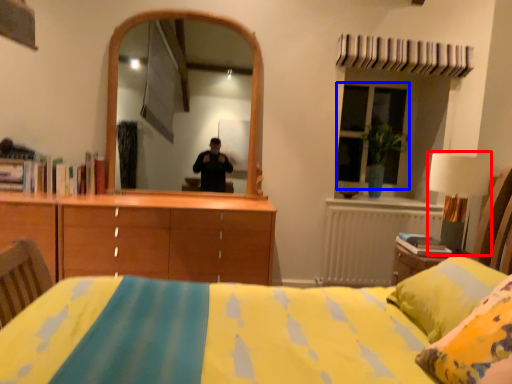
Question: Which of the following is the farthest to the observer, table lamp (highlighted by a red box) or window (highlighted by a blue box)?

Choices:
 (A) table lamp
 (B) window

Answer: (B)